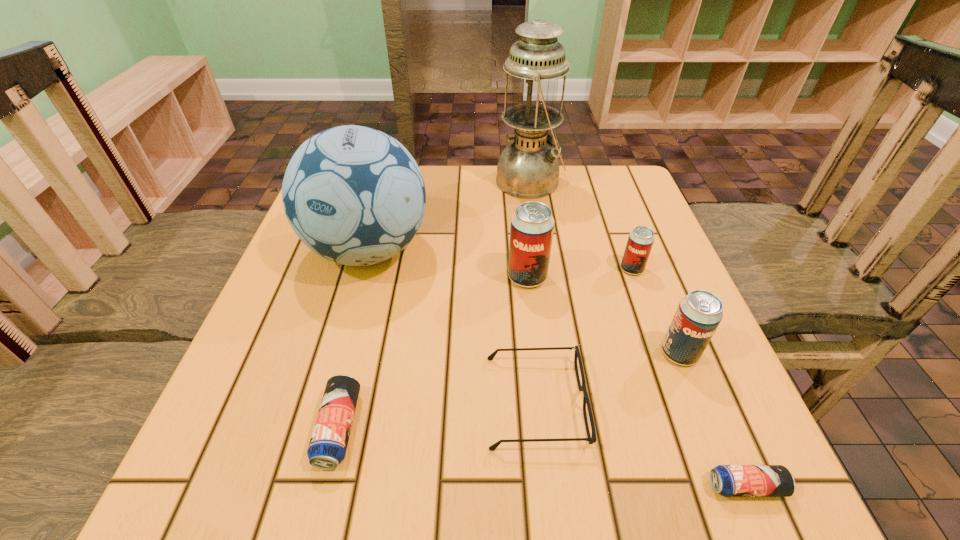
This screenshot has width=960, height=540. Find the location of `free space located on the back of the sixth tallest object`. free space located on the back of the sixth tallest object is located at coordinates pos(383,248).

Find the location of a particular element. The height and width of the screenshot is (540, 960). vacant region located 0.130m on the front-facing side of the spectacles is located at coordinates click(664, 402).

Where is `vacant space located 0.230m on the left of the nearer blue beer can`? vacant space located 0.230m on the left of the nearer blue beer can is located at coordinates (544, 487).

Where is `oil lamp present at the far edge`? This screenshot has height=540, width=960. oil lamp present at the far edge is located at coordinates (528, 168).

Locate an element on the screen. Image resolution: width=960 pixels, height=540 pixels. soccer ball located at the far edge is located at coordinates (354, 195).

What are the coordinates of `spectacles present at the near edge` in the screenshot? It's located at (592, 439).

Identify the location of object located at the left edge. This screenshot has width=960, height=540. (354, 195).

Image resolution: width=960 pixels, height=540 pixels. I want to click on object that is at the far left corner, so click(354, 195).

Find the location of `object present at the near right corner`. object present at the near right corner is located at coordinates (728, 480).

Locate an element on the screen. The width and height of the screenshot is (960, 540). vacant region at the far edge of the desktop is located at coordinates (512, 201).